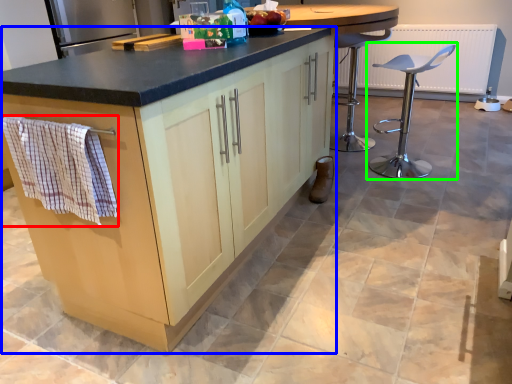
Question: Which is farther away from hand towel (highlighted by a red box)? cabinetry (highlighted by a blue box) or chair (highlighted by a green box)?

Choices:
 (A) cabinetry
 (B) chair

Answer: (B)